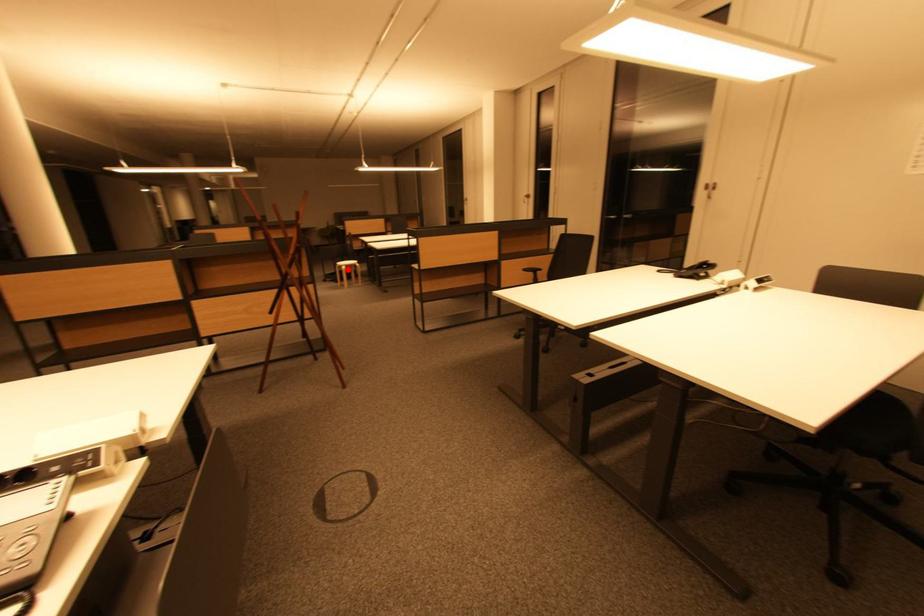
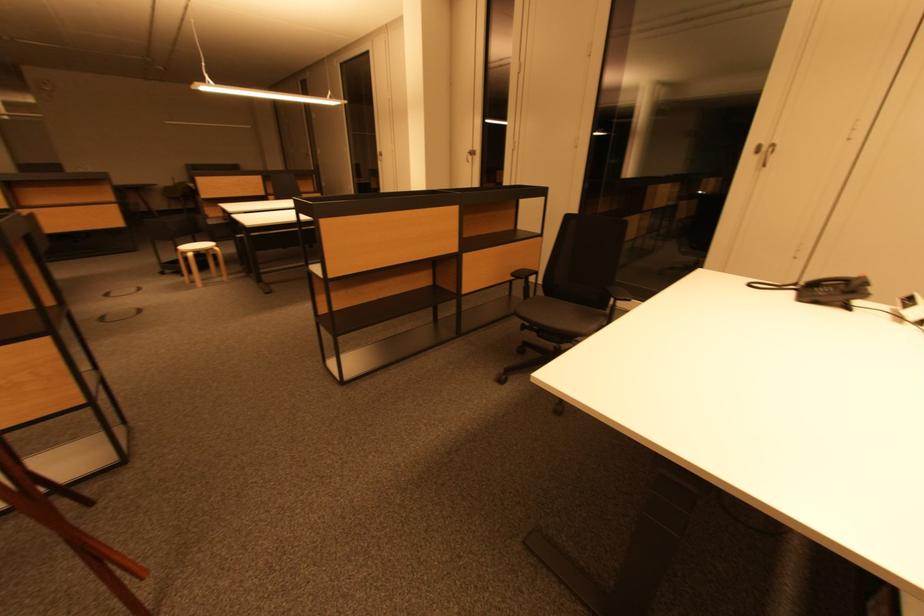
Question: A red point is marked in image1. In image2, is the corresponding 3D point closer to the camera or farther? Reply with the corresponding letter.

Choices:
 (A) The corresponding 3D point is closer.
 (B) The corresponding 3D point is farther.

Answer: (B)